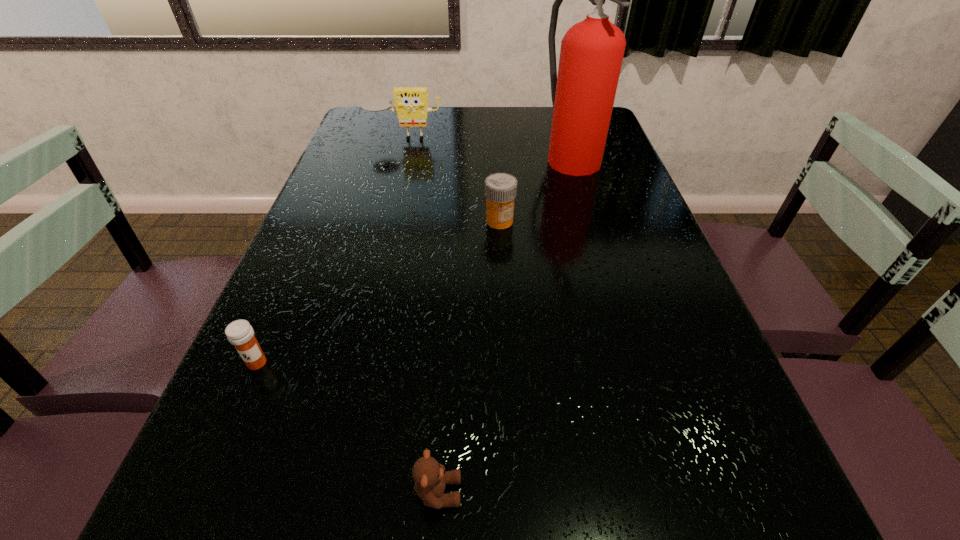
The height and width of the screenshot is (540, 960). In order to click on object located in the far left corner section of the desktop in this screenshot , I will do `click(411, 104)`.

Identify the location of object at the far right corner. (583, 93).

In the image, there is a desktop. Where is `vacant region at the far edge`? The image size is (960, 540). vacant region at the far edge is located at coordinates (437, 134).

The image size is (960, 540). Find the location of `vacant position at the near edge of the desktop`. vacant position at the near edge of the desktop is located at coordinates (616, 535).

Image resolution: width=960 pixels, height=540 pixels. I want to click on blank area at the left edge, so click(x=255, y=447).

Locate an element on the screen. The width and height of the screenshot is (960, 540). vacant area at the right edge of the desktop is located at coordinates (693, 420).

Identify the location of vacant point located between the right medicine and the tallest object. (535, 188).

Where is `unoccupied area between the rightmost object and the sponge`? The height and width of the screenshot is (540, 960). unoccupied area between the rightmost object and the sponge is located at coordinates (488, 146).

Locate an element on the screen. vacant point located between the rightmost object and the left medicine is located at coordinates (414, 259).

The image size is (960, 540). I want to click on vacant point located between the second nearest object and the sponge, so [x=331, y=250].